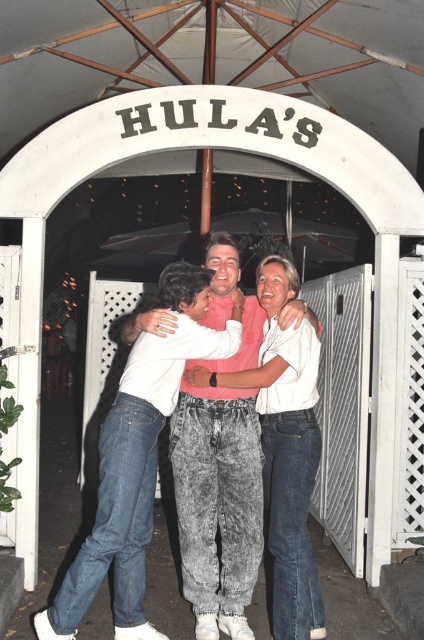
Which is in front, point (195, 406) or point (114, 465)?

Point (114, 465) is in front.

What do you see at coordinates (217, 499) in the screenshot? I see `white cotton shirt at center` at bounding box center [217, 499].

Where is `white cotton shirt at center`? Image resolution: width=424 pixels, height=640 pixels. white cotton shirt at center is located at coordinates (217, 499).